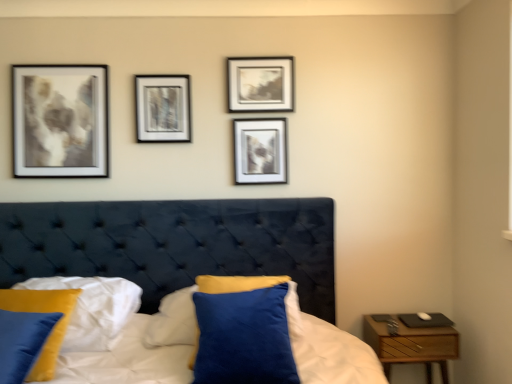
Question: From the image's perspective, is metallic silver frame at center, the 3th picture frame in the right-to-left sequence, located above or below matte black picture frame at upper center, positioned as the 3th picture frame in left-to-right order?

Choices:
 (A) above
 (B) below

Answer: (B)

Question: Is metallic silver frame at center, the first picture frame when ordered from left to right, bigger or smaller than matte black picture frame at upper center, positioned as the 3th picture frame in left-to-right order?

Choices:
 (A) small
 (B) big

Answer: (A)

Question: Which object is the farthest from the velvet blue pillow at lower left, positioned as the first pillow in left-to-right order?

Choices:
 (A) wooden nightstand at right
 (B) matte silver picture frame at upper center, the 2th picture frame positioned from the right
 (C) velvety blue pillow at center, which is counted as the second pillow, starting from the left
 (D) metallic silver frame at center, the 3th picture frame in the right-to-left sequence
 (E) matte black picture frame at upper center, positioned as the 3th picture frame in left-to-right order

Answer: (A)

Question: Which object is the closest to the velvet blue pillow at lower left, which appears as the 2th pillow when viewed from the right?

Choices:
 (A) matte black picture frame at upper center, which is the 1th picture frame in right-to-left order
 (B) wooden nightstand at right
 (C) velvety blue pillow at center, which is the first pillow from right to left
 (D) matte silver picture frame at upper center, marked as the 2th picture frame in a left-to-right arrangement
 (E) metallic silver frame at center, the first picture frame when ordered from left to right

Answer: (C)